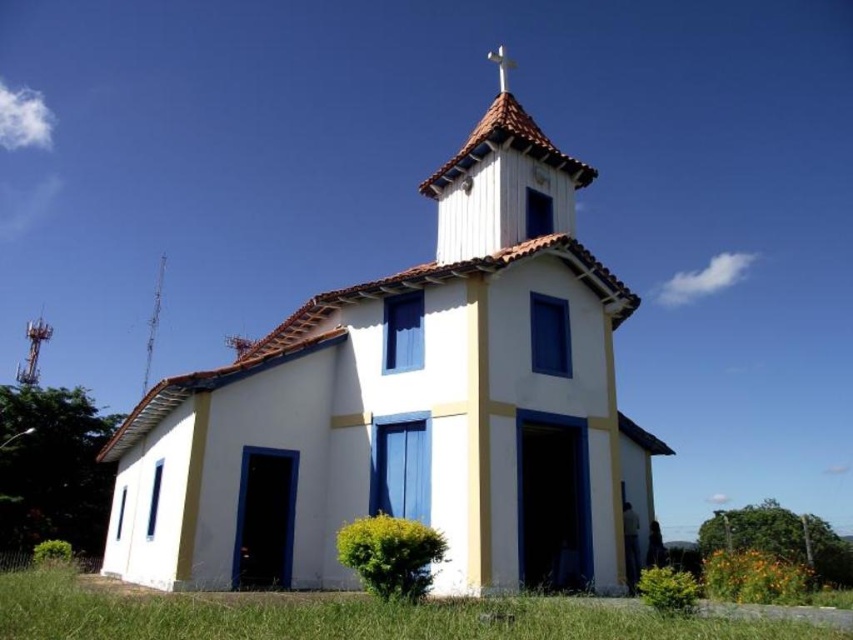
Which is more to the right, white painted wood church at center or green grass at lower center?

Positioned to the right is white painted wood church at center.

The height and width of the screenshot is (640, 853). I want to click on white painted wood church at center, so click(408, 406).

In order to click on white painted wood church at center in this screenshot , I will do `click(408, 406)`.

Describe the element at coordinates (408, 406) in the screenshot. I see `white painted wood church at center` at that location.

Locate an element on the screen. The width and height of the screenshot is (853, 640). white painted wood church at center is located at coordinates tap(408, 406).

Who is more forward, (341, 608) or (144, 376)?

Point (341, 608) is in front.

Does green grass at lower center have a larger size compared to smooth white spire at upper center?

Indeed, green grass at lower center has a larger size compared to smooth white spire at upper center.

What do you see at coordinates (343, 616) in the screenshot?
I see `green grass at lower center` at bounding box center [343, 616].

Image resolution: width=853 pixels, height=640 pixels. In order to click on green grass at lower center in this screenshot , I will do `click(343, 616)`.